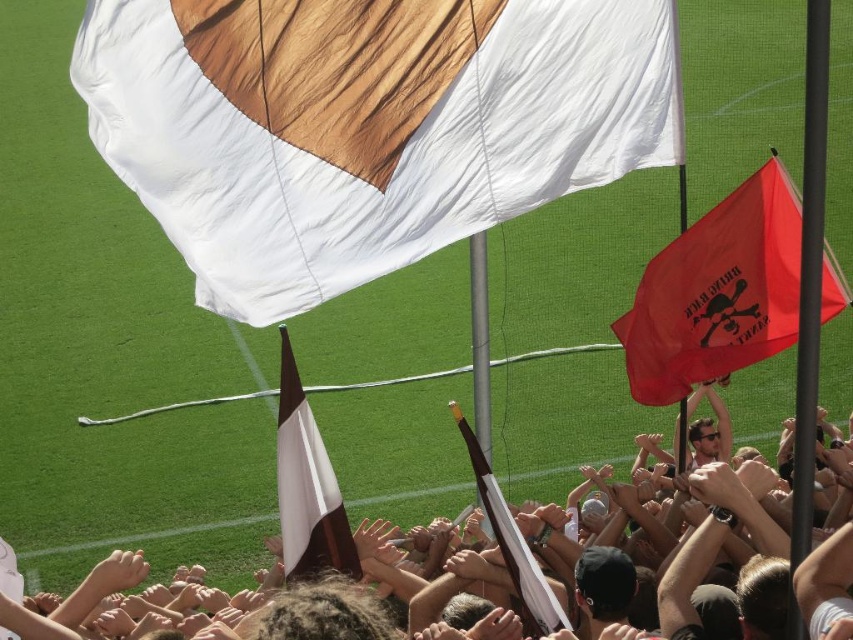
You are a photographer standing in the crowd at the soccer match. You want to take a picture of the red fabric flag at right. Where should you aim your camera to capture it?

You should aim your camera at point (717,292) to capture the red fabric flag at right.